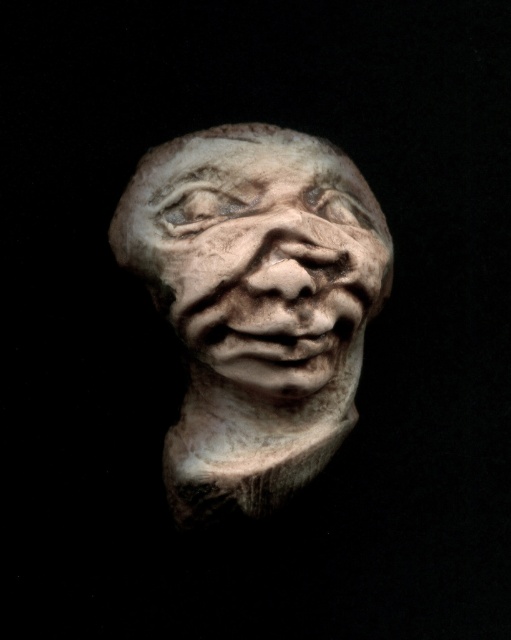
Who is lower down, white clay bust at center or white stone face at center?

white clay bust at center

Between white clay bust at center and white stone face at center, which one has more height?

white clay bust at center

Which is behind, point (291, 476) or point (276, 333)?

Point (291, 476)

Identify the location of white clay bust at center. This screenshot has height=640, width=511. (256, 305).